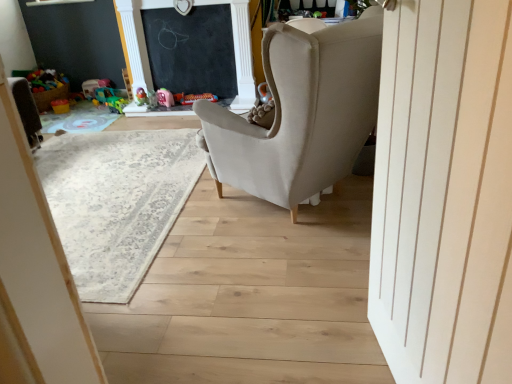
Question: Is matte orange toy at center, the 1th toy from the left, located outside rubberized green toy at upper left, the 4th toy in the right-to-left sequence?

Choices:
 (A) no
 (B) yes

Answer: (B)

Question: Would you say matte orange toy at center, the 1th toy from the left, contains rubberized green toy at upper left, the 4th toy in the right-to-left sequence?

Choices:
 (A) yes
 (B) no

Answer: (B)

Question: Does matte orange toy at center, placed as the sixth toy when sorted from right to left, have a greater width compared to rubberized green toy at upper left, which is counted as the 3th toy, starting from the left?

Choices:
 (A) no
 (B) yes

Answer: (B)

Question: Is matte orange toy at center, placed as the sixth toy when sorted from right to left, smaller than rubberized green toy at upper left, which is counted as the 3th toy, starting from the left?

Choices:
 (A) no
 (B) yes

Answer: (A)

Question: Is matte orange toy at center, placed as the sixth toy when sorted from right to left, looking in the opposite direction of rubberized green toy at upper left, the 4th toy in the right-to-left sequence?

Choices:
 (A) yes
 (B) no

Answer: (B)

Question: Considering their positions, is matte orange toy at center, the 1th toy from the left, located in front of or behind rubberized green toy at center, the second toy in the left-to-right sequence?

Choices:
 (A) front
 (B) behind

Answer: (B)

Question: From their relative heights in the image, would you say matte orange toy at center, the 1th toy from the left, is taller or shorter than rubberized green toy at center, which is the fifth toy in right-to-left order?

Choices:
 (A) short
 (B) tall

Answer: (A)

Question: From a real-world perspective, is matte orange toy at center, the 1th toy from the left, above or below rubberized green toy at center, which is the fifth toy in right-to-left order?

Choices:
 (A) below
 (B) above

Answer: (A)

Question: Is matte orange toy at center, placed as the sixth toy when sorted from right to left, situated inside rubberized green toy at center, the second toy in the left-to-right sequence, or outside?

Choices:
 (A) outside
 (B) inside

Answer: (A)

Question: Considering the positions of beige carpet at center and rubberized green toy at upper left, which is counted as the 3th toy, starting from the left, in the image, is beige carpet at center taller or shorter than rubberized green toy at upper left, which is counted as the 3th toy, starting from the left,?

Choices:
 (A) short
 (B) tall

Answer: (A)

Question: Is point (174, 135) closer or farther from the camera than point (137, 97)?

Choices:
 (A) closer
 (B) farther

Answer: (A)

Question: From a real-world perspective, is beige carpet at center physically located above or below rubberized green toy at upper left, which is counted as the 3th toy, starting from the left?

Choices:
 (A) above
 (B) below

Answer: (B)

Question: Is beige carpet at center wider or thinner than rubberized green toy at upper left, which is counted as the 3th toy, starting from the left?

Choices:
 (A) thin
 (B) wide

Answer: (B)

Question: Is rubberized green toy at center, which is the fifth toy in right-to-left order, inside or outside of rubberized green toy at upper left, which is counted as the 3th toy, starting from the left?

Choices:
 (A) inside
 (B) outside

Answer: (B)

Question: Is rubberized green toy at center, the second toy in the left-to-right sequence, taller or shorter than rubberized green toy at upper left, the 4th toy in the right-to-left sequence?

Choices:
 (A) tall
 (B) short

Answer: (A)